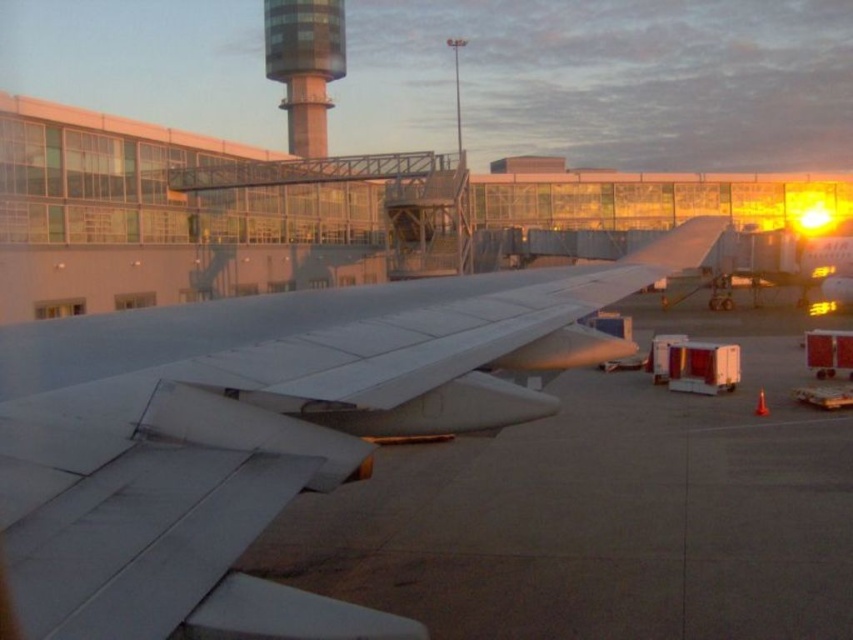
You are a pilot preparing for takeoff and notice the glassy steel control tower at upper center and the clear glass airplane window at center. Which object is closer to you from your current position inside the cockpit?

The clear glass airplane window at center is closer to you because the control tower is further away as described.

Based on the photo, you are a passenger sitting at point [140,401] and want to reach point [53,304]. Which direction should you move to get closer to your destination?

Since point [140,401] is closer to the camera than point [53,304], you should move away from the camera to reach your destination.